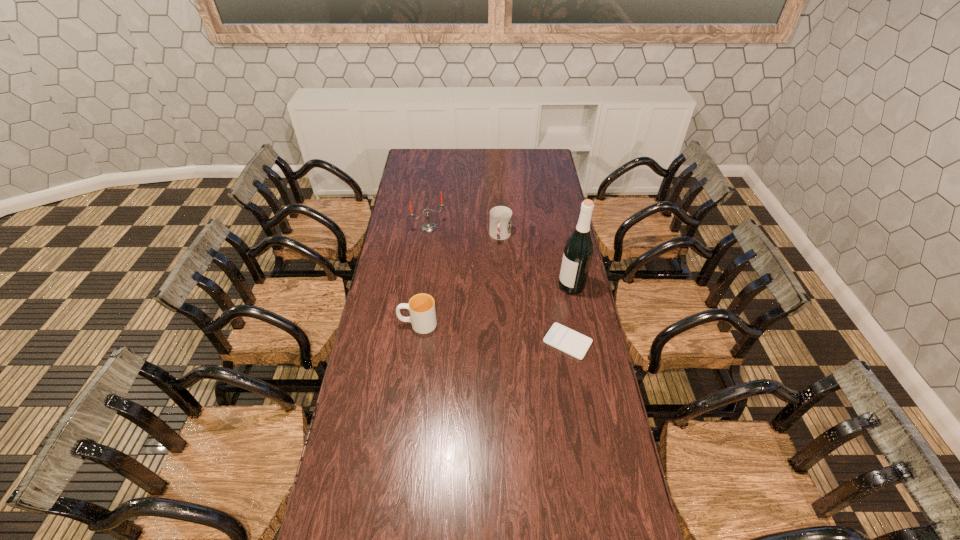
I want to click on vacant spot on the desktop that is between the nearer cup and the shortest object and is positioned on the front-facing side of the second tallest object, so click(x=514, y=335).

Find the location of a particular element. The image size is (960, 540). free space on the desktop that is between the nearer cup and the shortest object and is positioned on the label of the tallest object is located at coordinates click(x=471, y=330).

The height and width of the screenshot is (540, 960). What are the coordinates of `free space on the desktop that is between the left cup and the calculator and is positioned on the side of the third object from right to left where the handle is located` in the screenshot? It's located at click(482, 332).